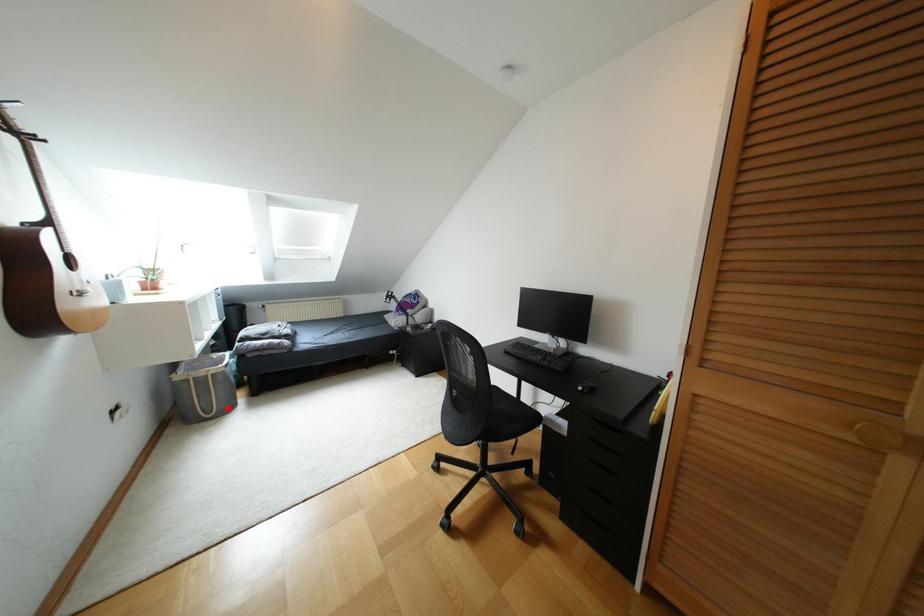
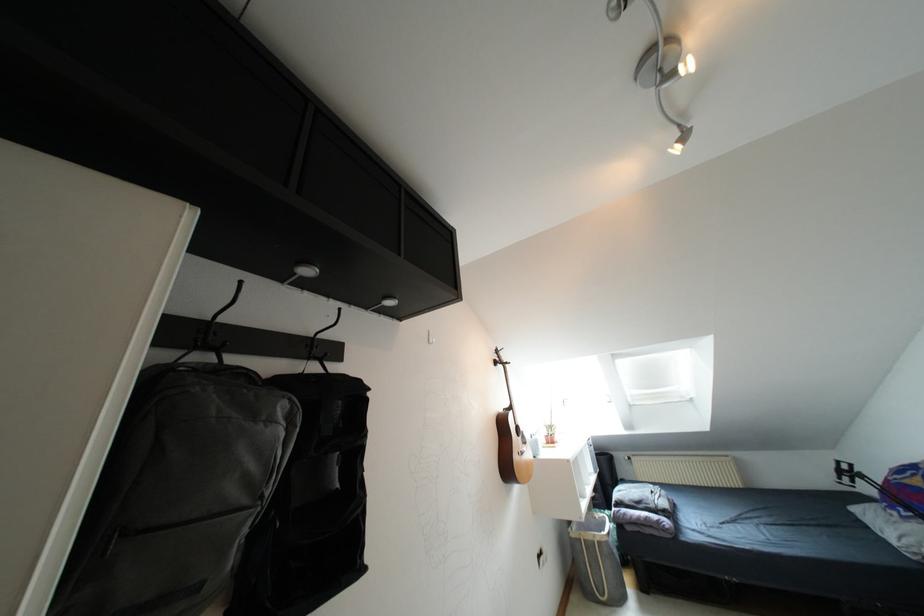
Locate, in the second image, the point that corresponds to the highlighted location in the first image.

(618, 599)